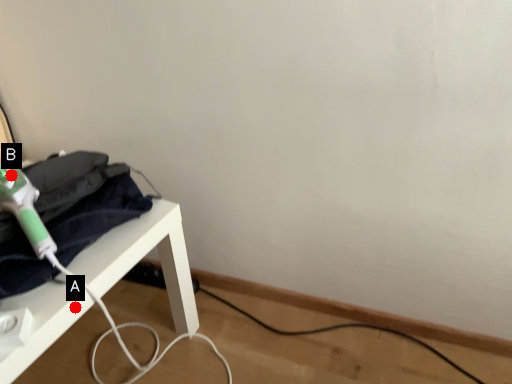
Question: Two points are circled on the image, labeled by A and B beside each circle. Which point is further to the camera?

Choices:
 (A) A is further
 (B) B is further

Answer: (B)